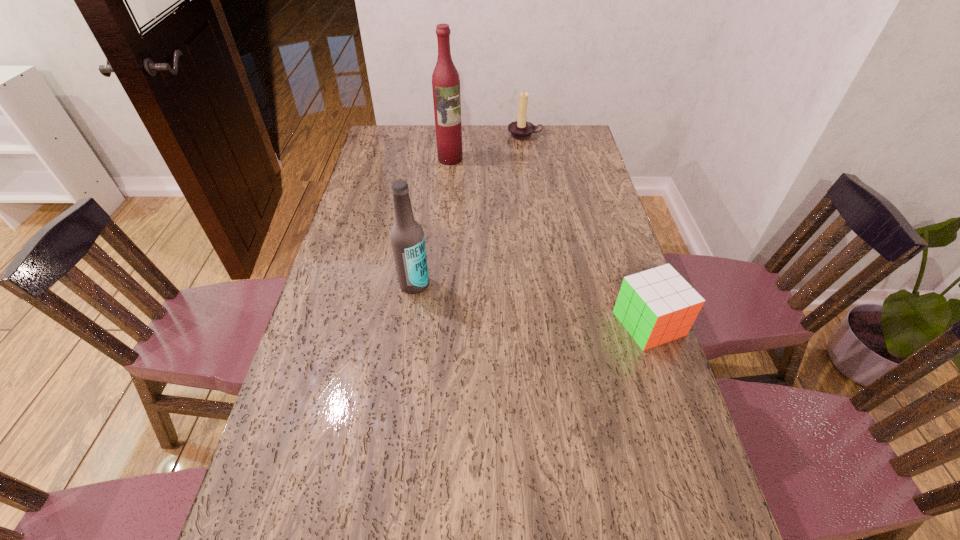
You are a GUI agent. You are given a task and a screenshot of the screen. Output one action in this format:
    pyautogui.click(x=<x>, y=<y>)
    Task: Click on the third shortest object
    
    Given the screenshot: What is the action you would take?
    pyautogui.click(x=407, y=237)

The image size is (960, 540). In order to click on beer bottle in this screenshot , I will do `click(407, 237)`.

This screenshot has width=960, height=540. I want to click on the shortest object, so click(x=656, y=306).

Image resolution: width=960 pixels, height=540 pixels. I want to click on the nearest object, so click(656, 306).

The height and width of the screenshot is (540, 960). I want to click on the second object from right to left, so click(x=521, y=129).

This screenshot has height=540, width=960. I want to click on candle holder, so click(x=521, y=129).

Locate an element on the screen. This screenshot has width=960, height=540. liquor is located at coordinates (445, 79).

You are a GUI agent. You are given a task and a screenshot of the screen. Output one action in this format:
    pyautogui.click(x=<x>, y=<y>)
    Task: Click on the tallest object
    The height and width of the screenshot is (540, 960).
    Given the screenshot: What is the action you would take?
    pyautogui.click(x=445, y=79)

Find the location of `vacant space located 0.060m on the side of the beer bottle with the label`. vacant space located 0.060m on the side of the beer bottle with the label is located at coordinates (411, 312).

The image size is (960, 540). Find the location of `vacant space situated 0.380m on the back of the nearest object`. vacant space situated 0.380m on the back of the nearest object is located at coordinates (612, 214).